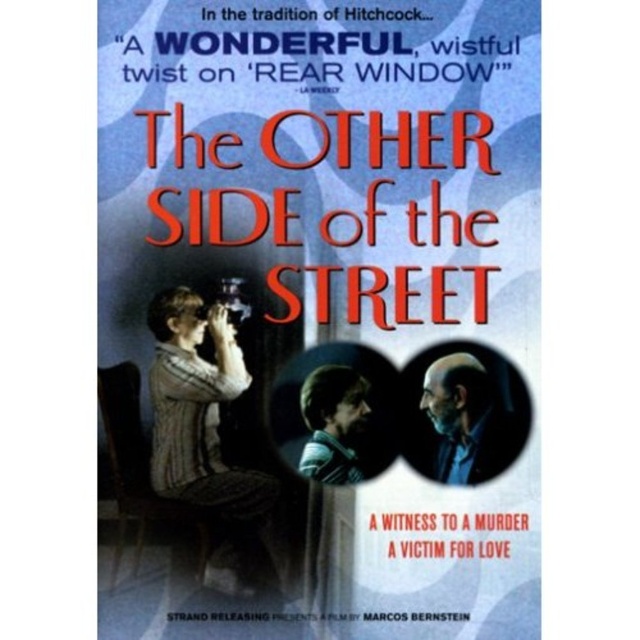
Question: Can you confirm if matte black camera at upper left is positioned to the right of knitted sweater at center?

Choices:
 (A) no
 (B) yes

Answer: (B)

Question: Can you confirm if gray hair at center is wider than smooth brown hair at center?

Choices:
 (A) no
 (B) yes

Answer: (B)

Question: Which point is closer to the camera taking this photo?

Choices:
 (A) (243, 440)
 (B) (467, 451)

Answer: (B)

Question: Where is matte black camera at upper left located in relation to smooth brown hair at center in the image?

Choices:
 (A) above
 (B) below

Answer: (A)

Question: Which of the following is the farthest from the observer?

Choices:
 (A) (344, 376)
 (B) (179, 285)

Answer: (A)

Question: Among these points, which one is farthest from the camera?

Choices:
 (A) (237, 355)
 (B) (332, 401)
 (C) (314, 588)
 (D) (436, 464)

Answer: (A)